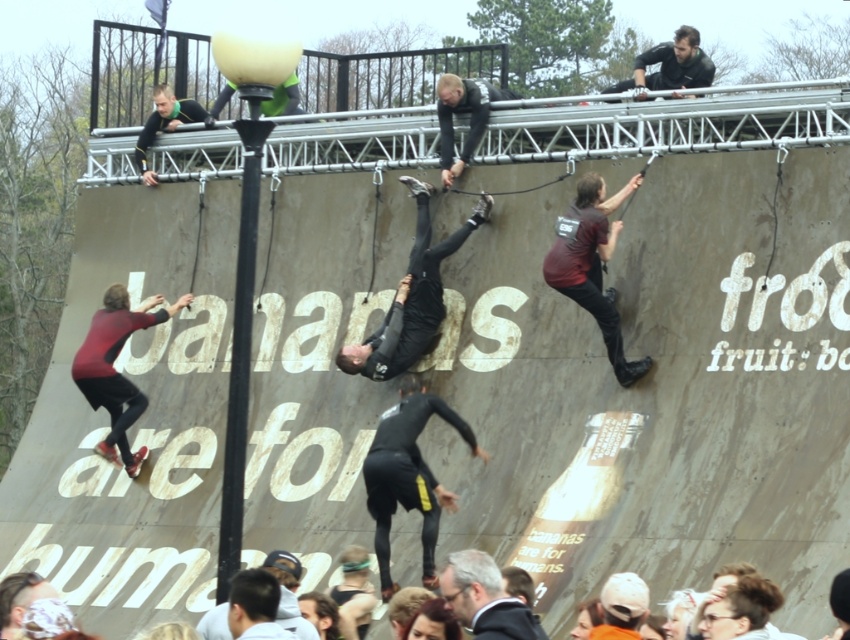
Between dark gray suit at lower center and dark brown leather jacket at lower center, which one appears on the right side from the viewer's perspective?

From the viewer's perspective, dark gray suit at lower center appears more on the right side.

Which is behind, point (474, 577) or point (253, 576)?

The point (253, 576) is behind.

Who is more forward, (518, 600) or (265, 637)?

Point (265, 637) is more forward.

This screenshot has width=850, height=640. I want to click on dark gray suit at lower center, so click(x=484, y=598).

This screenshot has width=850, height=640. What do you see at coordinates (114, 369) in the screenshot?
I see `matte red skateboard at lower left` at bounding box center [114, 369].

Who is lower down, matte red skateboard at lower left or white matte baseball cap at lower center?

white matte baseball cap at lower center is lower down.

Between point (137, 397) and point (633, 602), which one is positioned behind?

The point (137, 397) is behind.

Locate an element on the screen. matte red skateboard at lower left is located at coordinates (114, 369).

Can you confirm if dark gray fabric at upper center is positioned below dark brown leather jacket at lower center?

No.

Is dark gray fabric at upper center wider than dark brown leather jacket at lower center?

Correct, the width of dark gray fabric at upper center exceeds that of dark brown leather jacket at lower center.

Where is `dark gray fabric at upper center`? dark gray fabric at upper center is located at coordinates (670, 65).